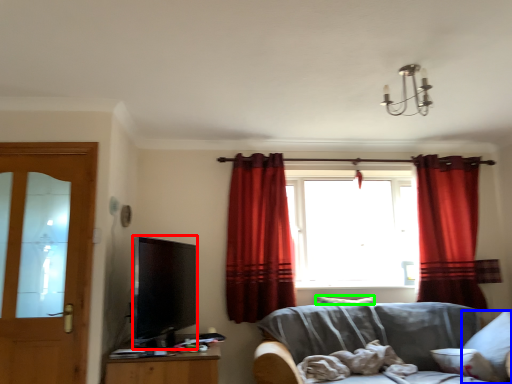
Question: Based on their relative distances, which object is nearer to television (highlighted by a red box)? Choose from pillow (highlighted by a blue box) and pillow (highlighted by a green box).

Choices:
 (A) pillow
 (B) pillow

Answer: (B)